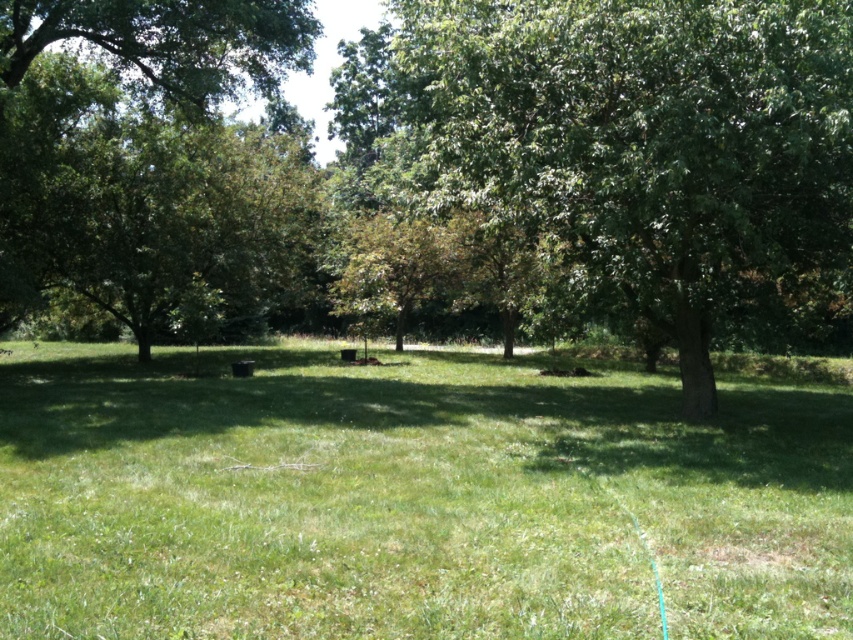
From the picture: Which is more to the right, green grassy field at center or green leafy tree at left?

green grassy field at center

Is green grassy field at center to the right of green leafy tree at left from the viewer's perspective?

Indeed, green grassy field at center is positioned on the right side of green leafy tree at left.

Is point (578, 532) farther from viewer compared to point (44, 28)?

No, it is in front of (44, 28).

Identify the location of green grassy field at center. The height and width of the screenshot is (640, 853). pyautogui.click(x=410, y=499).

Who is shorter, green leafy tree at center or green leafy tree at left?

Standing shorter between the two is green leafy tree at center.

Who is more distant from viewer, (606, 266) or (201, 38)?

The point (201, 38) is more distant.

The width and height of the screenshot is (853, 640). What are the coordinates of `green leafy tree at center` in the screenshot? It's located at (643, 140).

Does point (595, 465) lie in front of point (628, 157)?

That is False.

Which is more to the left, green grassy field at center or green leafy tree at center?

From the viewer's perspective, green grassy field at center appears more on the left side.

Which is in front, point (688, 456) or point (666, 83)?

Positioned in front is point (666, 83).

Find the location of a particular element. green grassy field at center is located at coordinates (410, 499).